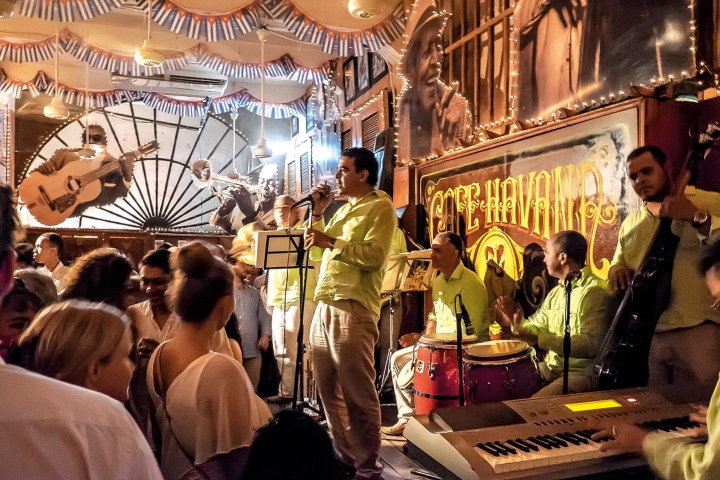
Where is `stage`? The height and width of the screenshot is (480, 720). stage is located at coordinates (379, 450).